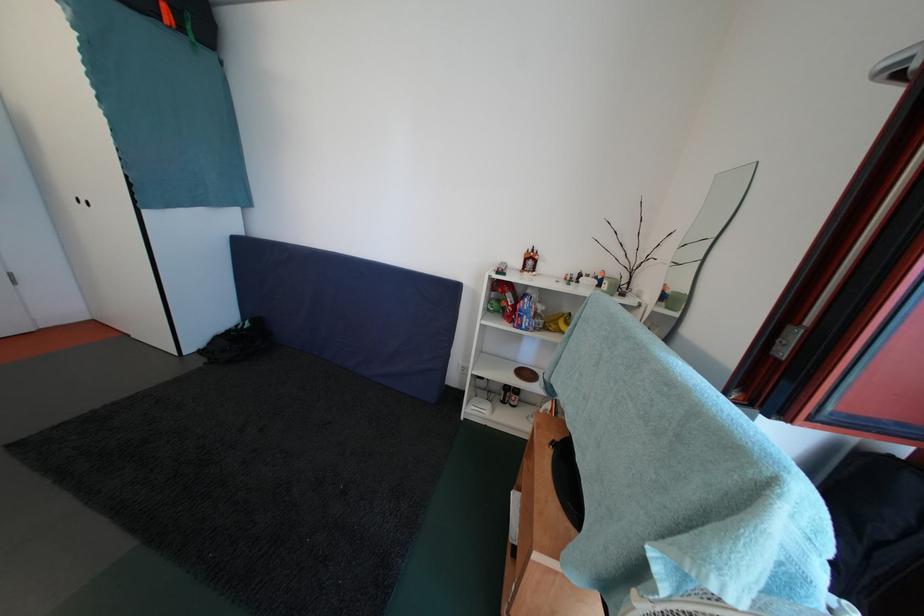
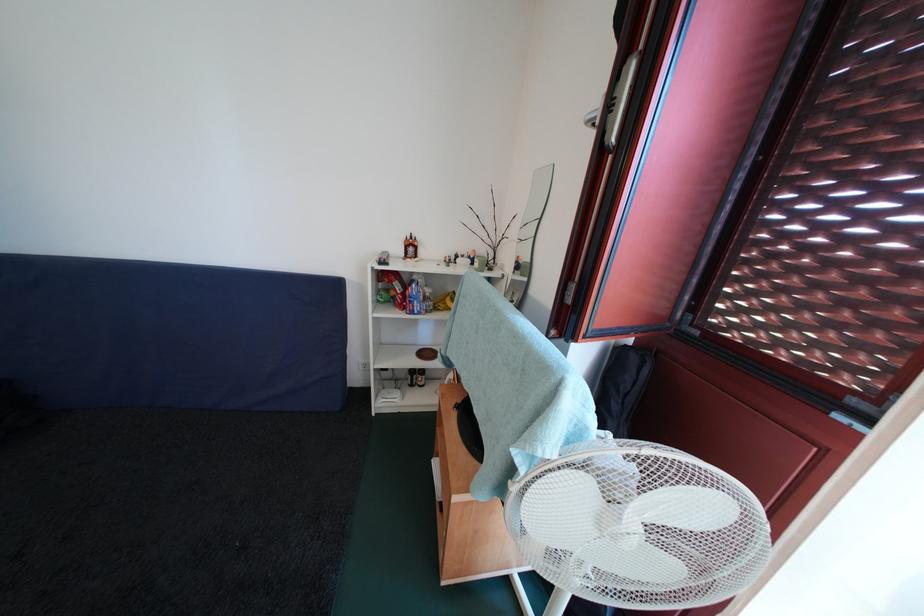
Find the pixel in the second image that matches point 515,307 in the first image.

(403, 296)